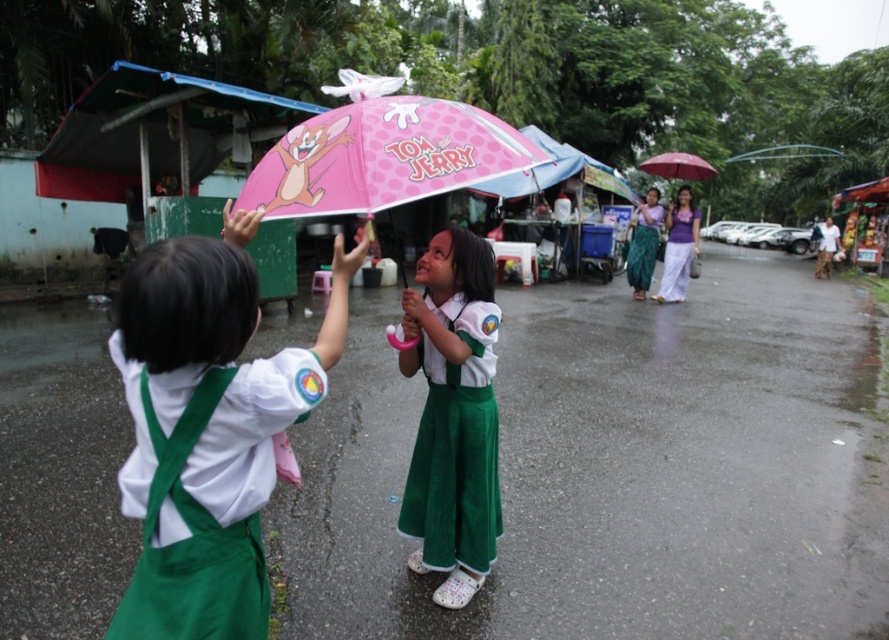
Can you confirm if pink matte umbrella at center is smaller than pink polka dot umbrella at upper center?

Yes.

Is pink matte umbrella at center positioned at the back of pink polka dot umbrella at upper center?

No.

Is point (351, 106) in front of point (693, 179)?

That is True.

This screenshot has height=640, width=889. I want to click on pink matte umbrella at center, so click(x=381, y=152).

Is velvety green dress at center in front of pink polka dot umbrella at upper center?

Yes.

Who is more distant from viewer, (459, 413) or (662, 168)?

Point (662, 168)

Who is more forward, (474, 314) or (645, 161)?

Point (474, 314) is more forward.

Where is `velvety green dress at center`? velvety green dress at center is located at coordinates (455, 445).

Which is behind, point (473, 561) or point (679, 266)?

Point (679, 266)

Between velvety green dress at center and purple cotton dress at center, which one has more height?

Standing taller between the two is purple cotton dress at center.

Which is in front, point (423, 561) or point (695, 212)?

Point (423, 561)

Locate an element on the screen. The height and width of the screenshot is (640, 889). velvety green dress at center is located at coordinates (455, 445).